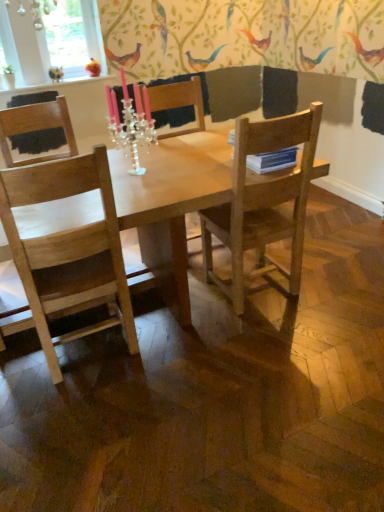
Image resolution: width=384 pixels, height=512 pixels. What do you see at coordinates (56, 73) in the screenshot?
I see `matte black bird at upper left, the second bird in the right-to-left sequence` at bounding box center [56, 73].

Measure the distance between point (x=50, y=71) and camera.

They are 3.52 meters apart.

What do you see at coordinates (263, 202) in the screenshot? I see `wooden chair at right, the 1th chair when ordered from right to left` at bounding box center [263, 202].

You are a GUI agent. You are given a task and a screenshot of the screen. Output one action in this format:
    pyautogui.click(x=<x>, y=<y>)
    Task: Click on the crystal clear candle holder at center
    
    Given the screenshot: What is the action you would take?
    pyautogui.click(x=130, y=123)

The image size is (384, 512). Describe the element at coordinates (44, 42) in the screenshot. I see `transparent glass window at upper left` at that location.

What do you see at coordinates (171, 199) in the screenshot? The width and height of the screenshot is (384, 512). I see `light brown wooden table at center` at bounding box center [171, 199].

Locate an element on the screen. The height and width of the screenshot is (512, 384). matte black bird at upper left, the second bird in the right-to-left sequence is located at coordinates (56, 73).

Does wooden chair at right, marked as the 2th chair in a left-to-right arrangement, have a smaller size compared to crystal clear candle holder at center?

No.

Locate an element on the screen. candle holder above the wooden chair at right, the 1th chair when ordered from right to left (from the image's perspective) is located at coordinates (130, 123).

From the image's perspective, which object appears higher, wooden chair at right, the 1th chair when ordered from right to left, or crystal clear candle holder at center?

crystal clear candle holder at center is shown above in the image.

Is crystal clear candle holder at center completely or partially inside wooden chair at right, the 1th chair when ordered from right to left?

That's incorrect, crystal clear candle holder at center is not inside wooden chair at right, the 1th chair when ordered from right to left.

From the image's perspective, would you say light brown wooden table at center is shown under wooden chair at right, the 1th chair when ordered from right to left?

Yes, from the image's perspective, light brown wooden table at center is beneath wooden chair at right, the 1th chair when ordered from right to left.

Which object is thinner, light brown wooden table at center or wooden chair at right, the 1th chair when ordered from right to left?

wooden chair at right, the 1th chair when ordered from right to left.

Does point (175, 266) appear closer or farther from the camera than point (207, 214)?

Point (175, 266) is positioned closer to the camera compared to point (207, 214).

Are light brown wooden table at center and wooden chair at right, the 1th chair when ordered from right to left, making contact?

No, light brown wooden table at center is not beside wooden chair at right, the 1th chair when ordered from right to left.

From the image's perspective, which is below, wooden chair at center or light brown wooden table at center?

From the image's view, light brown wooden table at center is below.

Looking at this image, is light brown wooden table at center at the back of wooden chair at center?

Yes, wooden chair at center is positioned with its back facing light brown wooden table at center.

Can you tell me how much wooden chair at center and light brown wooden table at center differ in facing direction?

There is a 5.11-degree angle between the facing directions of wooden chair at center and light brown wooden table at center.

Would you consider wooden chair at center to be distant from transparent glass window at upper left?

wooden chair at center is far away from transparent glass window at upper left.

Who is smaller, wooden chair at center or transparent glass window at upper left?

transparent glass window at upper left is smaller.

Is wooden chair at center positioned beyond the bounds of transparent glass window at upper left?

That's correct, wooden chair at center is outside of transparent glass window at upper left.

In terms of width, does wooden chair at center look wider or thinner when compared to transparent glass window at upper left?

Clearly, wooden chair at center has more width compared to transparent glass window at upper left.

Between crystal clear candle holder at center and light brown wooden table at center, which one has larger size?

Bigger between the two is light brown wooden table at center.

From the image's perspective, who appears lower, crystal clear candle holder at center or light brown wooden table at center?

From the image's view, light brown wooden table at center is below.

Can you confirm if crystal clear candle holder at center is wider than light brown wooden table at center?

In fact, crystal clear candle holder at center might be narrower than light brown wooden table at center.

Which object is positioned more to the left, crystal clear candle holder at center or light brown wooden table at center?

Positioned to the left is crystal clear candle holder at center.

Which of these two, light brown wooden table at center or wooden chair at left, the 1th chair positioned from the left, is smaller?

wooden chair at left, the 1th chair positioned from the left.

Does light brown wooden table at center turn towards wooden chair at left, marked as the second chair in a right-to-left arrangement?

Result: No, light brown wooden table at center is not turned towards wooden chair at left, marked as the second chair in a right-to-left arrangement.

From the image's perspective, which object appears higher, light brown wooden table at center or wooden chair at left, the 1th chair positioned from the left?

From the image's view, wooden chair at left, the 1th chair positioned from the left, is above.

Is point (156, 182) closer or farther from the camera than point (4, 147)?

Clearly, point (156, 182) is closer to the camera than point (4, 147).

In the image, is matte orange bird at upper left, placed as the 2th bird when sorted from left to right, positioned in front of or behind wooden chair at left, marked as the second chair in a right-to-left arrangement?

Visually, matte orange bird at upper left, placed as the 2th bird when sorted from left to right, is located behind wooden chair at left, marked as the second chair in a right-to-left arrangement.

Which is in front, point (92, 63) or point (55, 123)?

Point (55, 123)

Find the location of a particular element. The width and height of the screenshot is (384, 512). the 1st bird to the left of the wooden chair at left, marked as the second chair in a right-to-left arrangement, counting from the anchor's position is located at coordinates (93, 68).

Would you say matte orange bird at upper left, arranged as the first bird when viewed from the right, is inside or outside wooden chair at left, marked as the second chair in a right-to-left arrangement?

matte orange bird at upper left, arranged as the first bird when viewed from the right, is spatially situated outside wooden chair at left, marked as the second chair in a right-to-left arrangement.

Locate an element on the screen. Image resolution: width=384 pixels, height=512 pixels. candle holder positioned vertically above the wooden chair at right, the 1th chair when ordered from right to left (from a real-world perspective) is located at coordinates [x=130, y=123].

Where is `kitchen & dining room table located underneath the wooden chair at right, the 1th chair when ordered from right to left (from a real-world perspective)`? The width and height of the screenshot is (384, 512). kitchen & dining room table located underneath the wooden chair at right, the 1th chair when ordered from right to left (from a real-world perspective) is located at coordinates (171, 199).

From the image, which object appears to be farther from crystal clear candle holder at center, wooden chair at right, marked as the 2th chair in a left-to-right arrangement, or wooden chair at center?

wooden chair at right, marked as the 2th chair in a left-to-right arrangement, is further to crystal clear candle holder at center.

From the image, which object appears to be farther from crystal clear candle holder at center, matte black bird at upper left, marked as the first bird in a left-to-right arrangement, or wooden chair at right, the 1th chair when ordered from right to left?

The object further to crystal clear candle holder at center is matte black bird at upper left, marked as the first bird in a left-to-right arrangement.

When comparing their distances from light brown wooden table at center, does crystal clear candle holder at center or wooden chair at center seem closer?

crystal clear candle holder at center is positioned closer to the anchor light brown wooden table at center.

Which object lies further to the anchor point matte orange bird at upper left, placed as the 2th bird when sorted from left to right, transparent glass window at upper left or wooden chair at right, the 1th chair when ordered from right to left?

Among the two, wooden chair at right, the 1th chair when ordered from right to left, is located further to matte orange bird at upper left, placed as the 2th bird when sorted from left to right.

Estimate the real-world distances between objects in this image. Which object is further from wooden chair at right, the 1th chair when ordered from right to left, light brown wooden table at center or wooden chair at center?

wooden chair at center is positioned further to the anchor wooden chair at right, the 1th chair when ordered from right to left.

Considering their positions, is light brown wooden table at center positioned closer to transparent glass window at upper left than wooden chair at left, the 1th chair positioned from the left?

Among the two, wooden chair at left, the 1th chair positioned from the left, is located nearer to transparent glass window at upper left.

Considering their positions, is wooden chair at right, marked as the 2th chair in a left-to-right arrangement, positioned closer to matte orange bird at upper left, arranged as the first bird when viewed from the right, than wooden chair at left, the 1th chair positioned from the left?

wooden chair at left, the 1th chair positioned from the left, is positioned closer to the anchor matte orange bird at upper left, arranged as the first bird when viewed from the right.

Looking at the image, which one is located further to matte black bird at upper left, the second bird in the right-to-left sequence, crystal clear candle holder at center or light brown wooden table at center?

light brown wooden table at center is further to matte black bird at upper left, the second bird in the right-to-left sequence.

Where is `armchair between crystal clear candle holder at center and transparent glass window at upper left from front to back`? armchair between crystal clear candle holder at center and transparent glass window at upper left from front to back is located at coordinates (179, 102).

You are a GUI agent. You are given a task and a screenshot of the screen. Output one action in this format:
    pyautogui.click(x=<x>, y=<y>)
    Task: Click on the bird positioned between wooden chair at left, the 1th chair positioned from the left, and matte orange bird at upper left, placed as the 2th bird when sorted from left to right, from near to far
    This screenshot has width=384, height=512.
    Given the screenshot: What is the action you would take?
    pyautogui.click(x=56, y=73)

The width and height of the screenshot is (384, 512). Find the location of `bird positioned between crystal clear candle holder at center and matte orange bird at upper left, placed as the 2th bird when sorted from left to right, from near to far`. bird positioned between crystal clear candle holder at center and matte orange bird at upper left, placed as the 2th bird when sorted from left to right, from near to far is located at coordinates (56, 73).

Where is `candle holder between wooden chair at left, the 1th chair positioned from the left, and light brown wooden table at center`? candle holder between wooden chair at left, the 1th chair positioned from the left, and light brown wooden table at center is located at coordinates (130, 123).